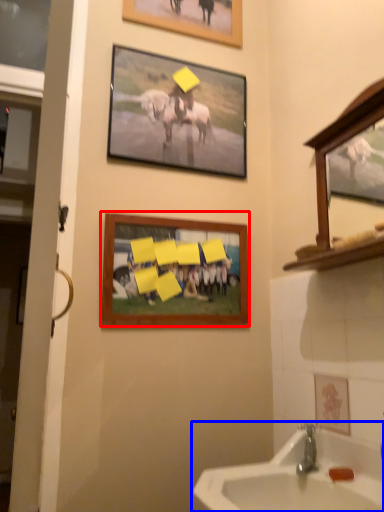
Question: Among these objects, which one is farthest to the camera, picture frame (highlighted by a red box) or sink (highlighted by a blue box)?

Choices:
 (A) picture frame
 (B) sink

Answer: (A)